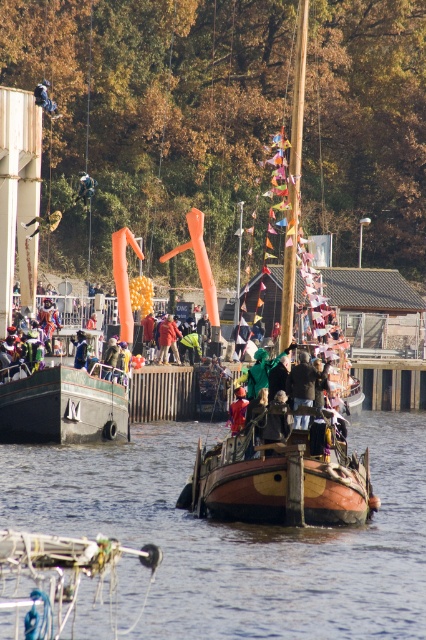
Question: Where is dark blue fabric at upper left located in relation to blue fabric jacket at center in the image?

Choices:
 (A) right
 (B) left

Answer: (B)

Question: Which point is farther from the camera taking this photo?

Choices:
 (A) (106, 355)
 (B) (226, 506)
 (C) (89, 192)

Answer: (C)

Question: Is green fabric jacket at center thinner than blue fabric person at center?

Choices:
 (A) yes
 (B) no

Answer: (A)

Question: Which is nearer to the orange fabric person at center?

Choices:
 (A) blue fabric person at center
 (B) wooden sailboat at center
 (C) brown wooden boat at center

Answer: (B)

Question: Which of the following is the farthest from the observer?

Choices:
 (A) blue fabric jacket at center
 (B) dark brown leather jacket at center

Answer: (A)

Question: Is green fabric jacket at center above blue fabric person at center?

Choices:
 (A) no
 (B) yes

Answer: (A)